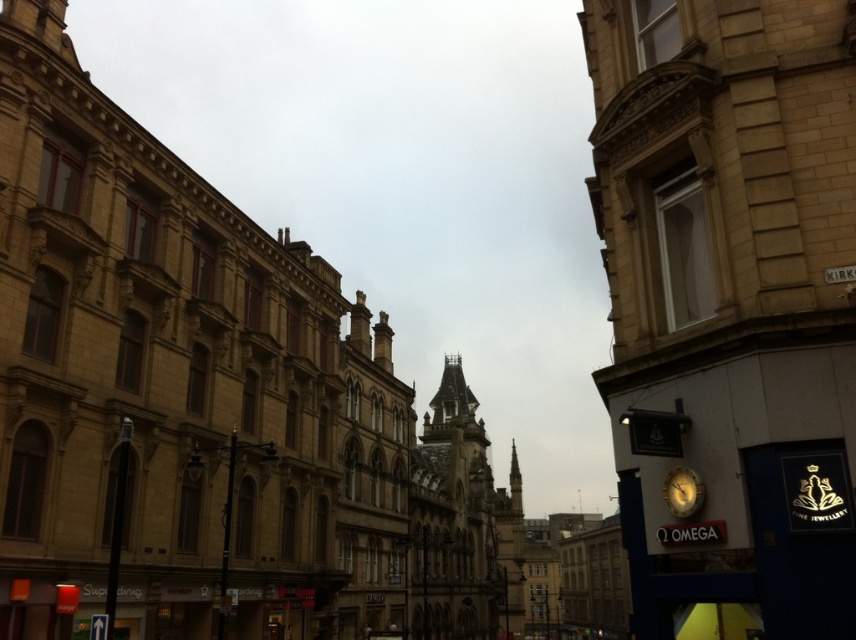
You are a tourist standing on the street and want to take a photo of both the stone gothic tower at center and the gold metallic clock at center right. Which object should you position closer to the left side of your camera frame to include both in the photo?

You should position the gold metallic clock at center right closer to the left side of your camera frame because the stone gothic tower at center is positioned on the right side of the gold metallic clock at center right, meaning the tower is further to the right than the clock.

You are an architect analyzing the proportions of the buildings in this historic street scene. Given that the stone gothic tower at center and the gold metallic clock at center right are both central elements, which object occupies more visual space in the composition?

The stone gothic tower at center occupies more visual space in the composition because it has a larger size compared to the gold metallic clock at center right.